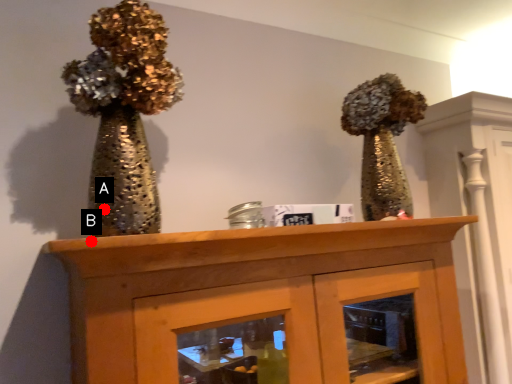
Question: Two points are circled on the image, labeled by A and B beside each circle. Which point appears closest to the camera in this image?

Choices:
 (A) A is closer
 (B) B is closer

Answer: (B)